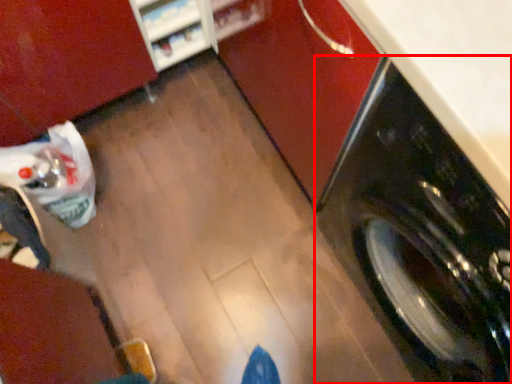
Question: From the image's perspective, what is the correct spatial positioning of washing machine (annotated by the red box) in reference to shelf?

Choices:
 (A) above
 (B) below

Answer: (B)